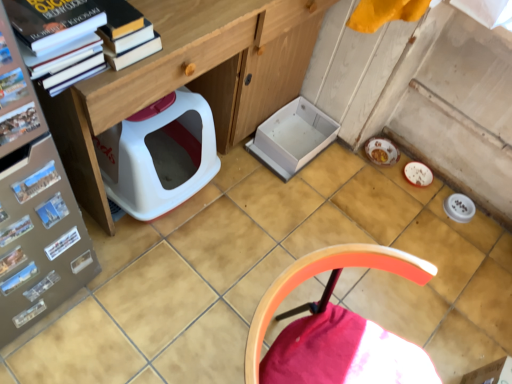
Question: From the image's perspective, would you say matte cardboard magazine at left, the seventh magazine when ordered from back to front, is positioned over metallic silver magazine at left, which is the fifth magazine in front-to-back order?

Choices:
 (A) no
 (B) yes

Answer: (B)

Question: Is matte cardboard magazine at left, which is the 1th magazine in front-to-back order, facing towards metallic silver magazine at left, the third magazine positioned from the back?

Choices:
 (A) yes
 (B) no

Answer: (B)

Question: From a real-world perspective, is matte cardboard magazine at left, which is the 1th magazine in front-to-back order, on top of metallic silver magazine at left, which is the fifth magazine in front-to-back order?

Choices:
 (A) no
 (B) yes

Answer: (B)

Question: Is matte cardboard magazine at left, which is the 1th magazine in front-to-back order, outside metallic silver magazine at left, which is the fifth magazine in front-to-back order?

Choices:
 (A) no
 (B) yes

Answer: (B)

Question: Is matte cardboard magazine at left, which is the 1th magazine in front-to-back order, positioned behind metallic silver magazine at left, which is the fifth magazine in front-to-back order?

Choices:
 (A) yes
 (B) no

Answer: (B)

Question: Is matte cardboard magazine at left, the seventh magazine when ordered from back to front, taller than metallic silver magazine at left, which is the fifth magazine in front-to-back order?

Choices:
 (A) yes
 (B) no

Answer: (B)

Question: Does metallic glossy magazine at left, positioned as the 2th magazine in front-to-back order, have a smaller size compared to metallic silver magazine at lower left, the first magazine positioned from the back?

Choices:
 (A) no
 (B) yes

Answer: (B)

Question: Considering the relative sizes of metallic glossy magazine at left, which ranks as the 6th magazine in back-to-front order, and metallic silver magazine at lower left, the 7th magazine when ordered from front to back, in the image provided, is metallic glossy magazine at left, which ranks as the 6th magazine in back-to-front order, shorter than metallic silver magazine at lower left, the 7th magazine when ordered from front to back,?

Choices:
 (A) yes
 (B) no

Answer: (A)

Question: Is metallic glossy magazine at left, positioned as the 2th magazine in front-to-back order, behind metallic silver magazine at lower left, the first magazine positioned from the back?

Choices:
 (A) yes
 (B) no

Answer: (B)

Question: Could you tell me if metallic glossy magazine at left, which ranks as the 6th magazine in back-to-front order, is turned towards metallic silver magazine at lower left, the first magazine positioned from the back?

Choices:
 (A) no
 (B) yes

Answer: (A)

Question: Is metallic glossy magazine at left, which ranks as the 6th magazine in back-to-front order, positioned far away from metallic silver magazine at lower left, the first magazine positioned from the back?

Choices:
 (A) yes
 (B) no

Answer: (B)

Question: Is metallic glossy magazine at left, which ranks as the 6th magazine in back-to-front order, thinner than metallic silver magazine at lower left, the 7th magazine when ordered from front to back?

Choices:
 (A) no
 (B) yes

Answer: (B)

Question: From the image's perspective, is white matte paper at left, positioned as the second paperback book in top-to-bottom order, beneath metallic glossy magazine at lower left, arranged as the 4th magazine when viewed from the front?

Choices:
 (A) no
 (B) yes

Answer: (A)